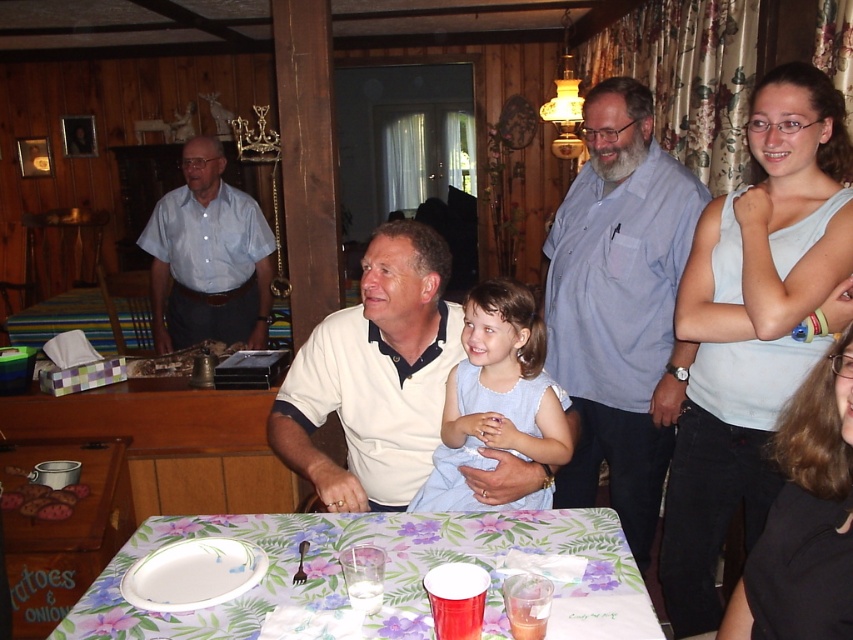
Between white cotton shirt at center and light blue fabric dress at center, which one is positioned higher?

white cotton shirt at center is above.

Looking at this image, is white cotton shirt at center to the right of light blue fabric dress at center from the viewer's perspective?

In fact, white cotton shirt at center is to the left of light blue fabric dress at center.

Does point (422, 296) come behind point (564, 433)?

Yes.

Locate an element on the screen. The image size is (853, 640). white cotton shirt at center is located at coordinates (374, 376).

Is point (445, 428) farther from viewer compared to point (222, 280)?

No.

Between light blue fabric dress at center and light blue shirt at upper left, which one is positioned higher?

light blue shirt at upper left

Where is `light blue fabric dress at center`? The width and height of the screenshot is (853, 640). light blue fabric dress at center is located at coordinates (495, 396).

Which is below, floral printed tablecloth at lower center or black fabric shirt at lower right?

floral printed tablecloth at lower center is below.

Consider the image. Does floral printed tablecloth at lower center appear over black fabric shirt at lower right?

Incorrect, floral printed tablecloth at lower center is not positioned above black fabric shirt at lower right.

Where is `floral printed tablecloth at lower center`? floral printed tablecloth at lower center is located at coordinates (341, 573).